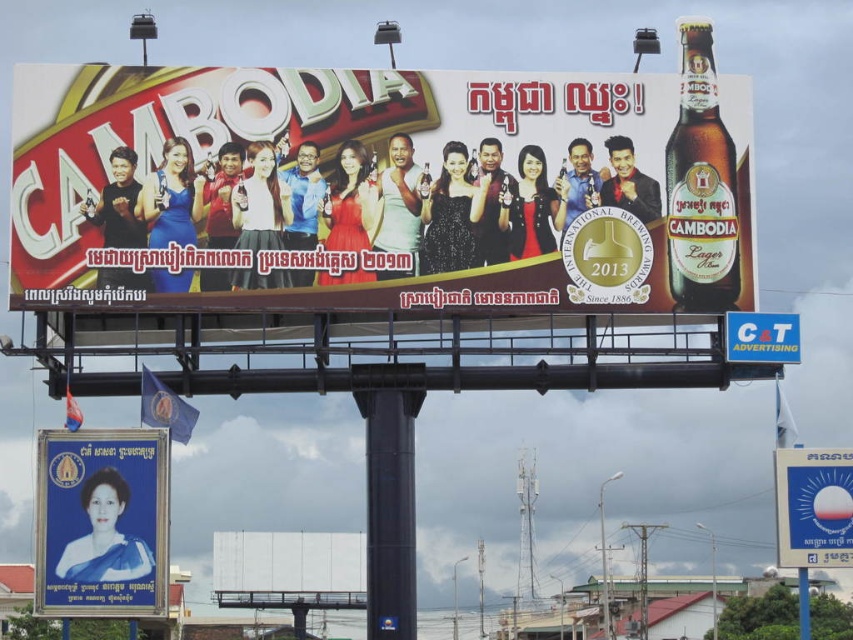
Which is in front, point (718, 157) or point (809, 513)?

Point (809, 513) is in front.

Does matte glass bottle at upper right have a greater width compared to white plastic sign at lower right?

No.

Is point (706, 93) more distant than point (821, 499)?

Yes.

At what (x,y) coordinates should I click in order to perform the action: click on matte glass bottle at upper right. Please return your answer as a coordinate pair (x, y). The image size is (853, 640). Looking at the image, I should click on (701, 186).

Can you confirm if white plastic sign at lower right is positioned above white plastic sign at upper center?

No.

The width and height of the screenshot is (853, 640). Find the location of `white plastic sign at lower right`. white plastic sign at lower right is located at coordinates (813, 506).

Does blue fabric portrait at lower left have a greater width compared to white plastic sign at upper center?

Yes.

This screenshot has height=640, width=853. Describe the element at coordinates (102, 522) in the screenshot. I see `blue fabric portrait at lower left` at that location.

I want to click on blue fabric portrait at lower left, so click(102, 522).